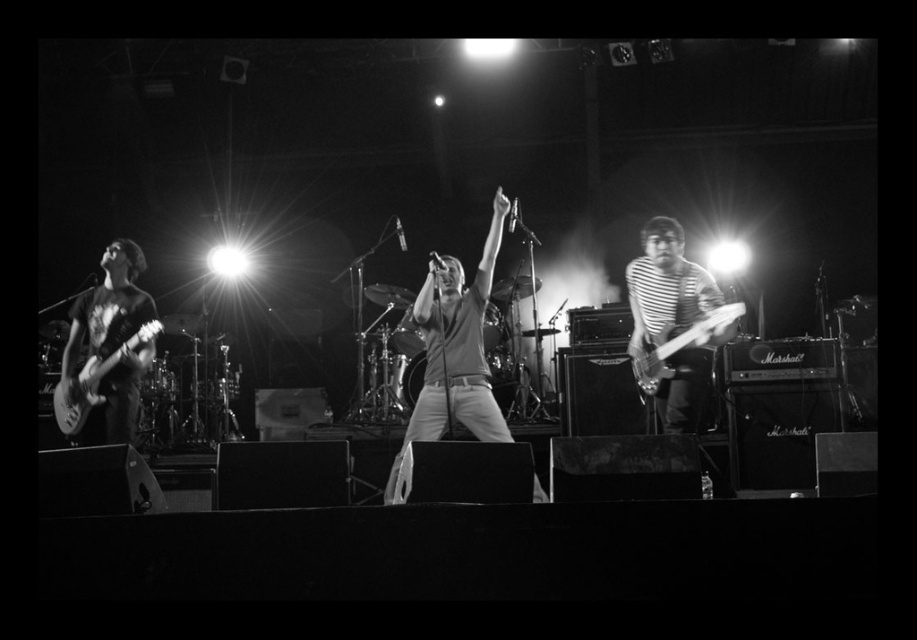
You are a photographer trying to capture the band members in the image. If you want to focus on the matte gray shirt at center and the metallic electric guitar at left, which one should you zoom in on to ensure both are fully visible in the frame?

The matte gray shirt at center is wider than the metallic electric guitar at left, so you should zoom in on the metallic electric guitar at left to ensure both are fully visible in the frame.

You are a photographer trying to capture the band members in the image. You notice two points marked in the scene. Which point, point 1 at coordinates [661,324] or point 2 at [87,371], is closer to the camera?

Point 1 at coordinates [661,324] is closer to the camera than point 2 at [87,371].

Based on the scene description, which object is positioned to the right of the other between the striped fabric guitar at right and the metallic electric guitar at left?

The striped fabric guitar at right is positioned to the right of the metallic electric guitar at left.